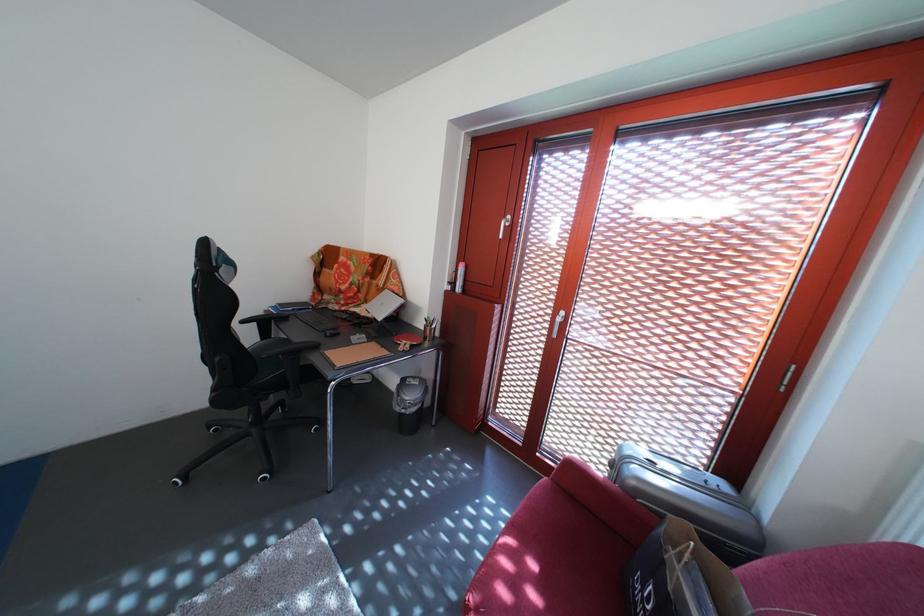
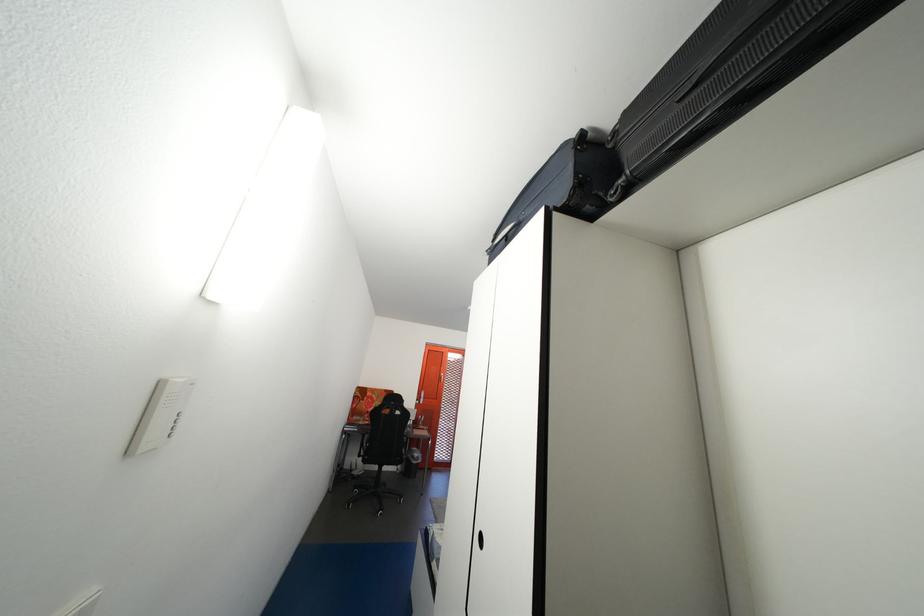
Question: I am providing you with two images of the same scene from different viewpoints. Which of the following objects are not visible in image2?

Choices:
 (A) orange door handle
 (B) white panel button
 (C) red sofa armrest
 (D) red binder hole

Answer: (C)